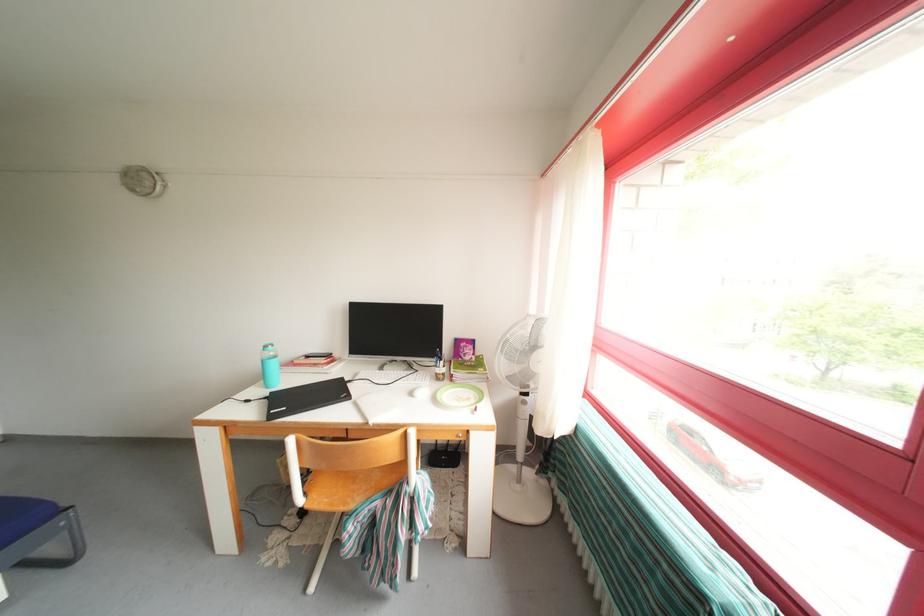
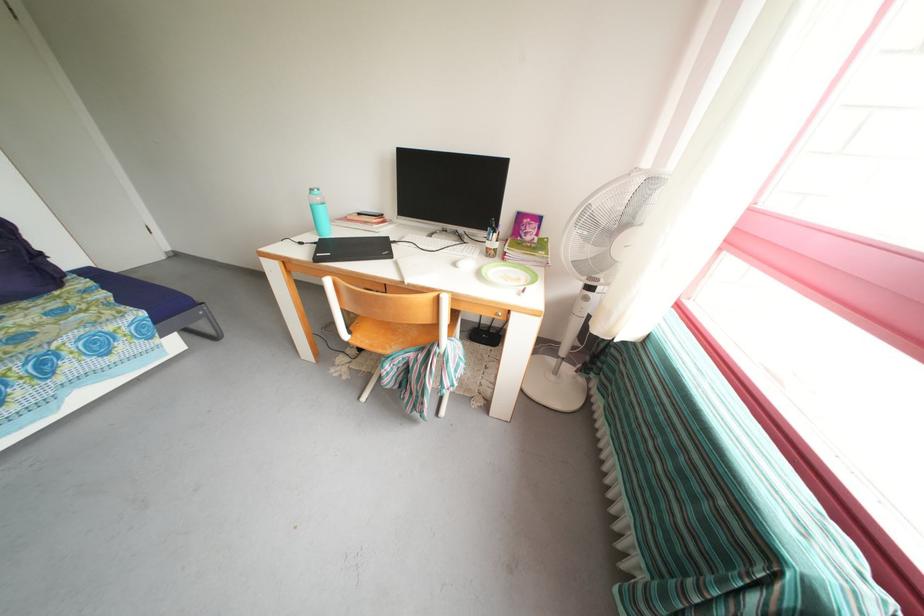
Where in the second image is the point corresponding to the point at 444,379 from the first image?

(494, 254)